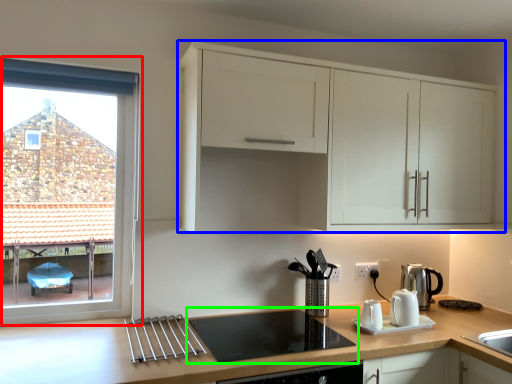
Question: Which object is the farthest from window (highlighted by a red box)? Choose among these: cabinetry (highlighted by a blue box) or gas stove (highlighted by a green box).

Choices:
 (A) cabinetry
 (B) gas stove

Answer: (A)